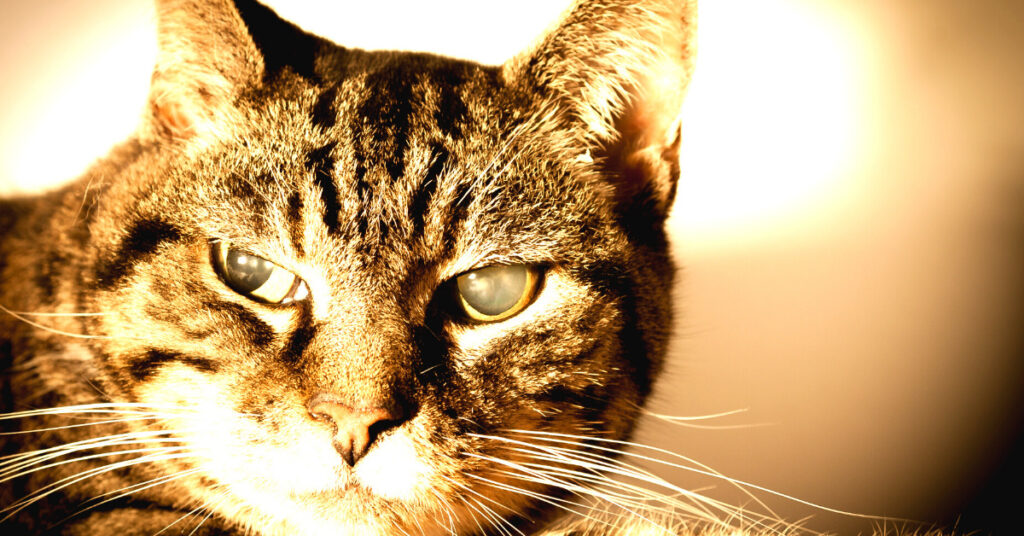
Identify the location of bright light. The height and width of the screenshot is (536, 1024). (69, 96), (768, 121).